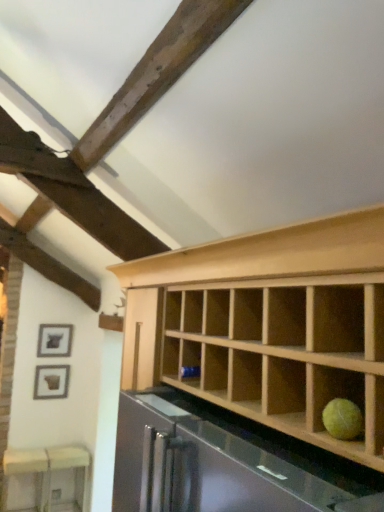
Describe the element at coordinates (51, 382) in the screenshot. I see `matte black picture frame at lower left, the 2th picture frame when ordered from top to bottom` at that location.

Image resolution: width=384 pixels, height=512 pixels. Identify the location of matte black picture frame at upper left, the second picture frame from the bottom. (54, 340).

You are a GUI agent. You are given a task and a screenshot of the screen. Output one action in this format:
    pyautogui.click(x=<x>, y=<y>)
    Task: Click on the matte black picture frame at lower left, the 2th picture frame when ordered from top to bottom
    Image resolution: width=384 pixels, height=512 pixels.
    Given the screenshot: What is the action you would take?
    pyautogui.click(x=51, y=382)

Does matte black picture frame at lower left, which ranks as the 1th picture frame in bottom-to-top order, have a greater height compared to white glossy table at lower left?

In fact, matte black picture frame at lower left, which ranks as the 1th picture frame in bottom-to-top order, may be shorter than white glossy table at lower left.

Which object is positioned more to the left, matte black picture frame at lower left, the 2th picture frame when ordered from top to bottom, or white glossy table at lower left?

white glossy table at lower left.

Is matte black picture frame at lower left, the 2th picture frame when ordered from top to bottom, aimed at matte black picture frame at upper left, the second picture frame from the bottom?

No, matte black picture frame at lower left, the 2th picture frame when ordered from top to bottom, is not aimed at matte black picture frame at upper left, the second picture frame from the bottom.

I want to click on picture frame on the left of matte black picture frame at upper left, the second picture frame from the bottom, so click(x=51, y=382).

Which object is further away from the camera taking this photo, matte black picture frame at lower left, which ranks as the 1th picture frame in bottom-to-top order, or matte black picture frame at upper left, acting as the first picture frame starting from the top?

matte black picture frame at upper left, acting as the first picture frame starting from the top, is further away from the camera.

Can you confirm if matte black picture frame at lower left, the 2th picture frame when ordered from top to bottom, is smaller than matte black picture frame at upper left, the second picture frame from the bottom?

No.

Considering the positions of objects white glossy table at lower left and matte black picture frame at upper left, acting as the first picture frame starting from the top, in the image provided, who is more to the left, white glossy table at lower left or matte black picture frame at upper left, acting as the first picture frame starting from the top,?

From the viewer's perspective, white glossy table at lower left appears more on the left side.

Does white glossy table at lower left have a lesser height compared to matte black picture frame at upper left, acting as the first picture frame starting from the top?

No.

Can you confirm if white glossy table at lower left is smaller than matte black picture frame at upper left, the second picture frame from the bottom?

No, white glossy table at lower left is not smaller than matte black picture frame at upper left, the second picture frame from the bottom.

From the image's perspective, is white glossy table at lower left beneath matte black picture frame at upper left, the second picture frame from the bottom?

Yes, from the image's perspective, white glossy table at lower left is below matte black picture frame at upper left, the second picture frame from the bottom.

Which object is more forward, white glossy table at lower left or matte black picture frame at lower left, which ranks as the 1th picture frame in bottom-to-top order?

Positioned in front is white glossy table at lower left.

Could you tell me if white glossy table at lower left is turned towards matte black picture frame at lower left, which ranks as the 1th picture frame in bottom-to-top order?

No, white glossy table at lower left is not oriented towards matte black picture frame at lower left, which ranks as the 1th picture frame in bottom-to-top order.

Which object is further away from the camera, matte black picture frame at upper left, the second picture frame from the bottom, or matte black picture frame at lower left, the 2th picture frame when ordered from top to bottom?

Positioned behind is matte black picture frame at upper left, the second picture frame from the bottom.

From a real-world perspective, which is physically above, matte black picture frame at upper left, acting as the first picture frame starting from the top, or matte black picture frame at lower left, which ranks as the 1th picture frame in bottom-to-top order?

From a 3D spatial view, matte black picture frame at upper left, acting as the first picture frame starting from the top, is above.

Can you confirm if matte black picture frame at upper left, acting as the first picture frame starting from the top, is wider than matte black picture frame at lower left, the 2th picture frame when ordered from top to bottom?

Incorrect, the width of matte black picture frame at upper left, acting as the first picture frame starting from the top, does not surpass that of matte black picture frame at lower left, the 2th picture frame when ordered from top to bottom.

Considering the positions of objects matte black picture frame at upper left, acting as the first picture frame starting from the top, and white glossy table at lower left in the image provided, who is in front, matte black picture frame at upper left, acting as the first picture frame starting from the top, or white glossy table at lower left?

white glossy table at lower left is closer to the camera.

Does matte black picture frame at upper left, the second picture frame from the bottom, have a lesser height compared to white glossy table at lower left?

Yes, matte black picture frame at upper left, the second picture frame from the bottom, is shorter than white glossy table at lower left.

Identify the location of picture frame that is the 2nd object located behind the white glossy table at lower left. (54, 340).

Does matte black picture frame at upper left, acting as the first picture frame starting from the top, have a larger size compared to white glossy table at lower left?

Incorrect, matte black picture frame at upper left, acting as the first picture frame starting from the top, is not larger than white glossy table at lower left.

You are a GUI agent. You are given a task and a screenshot of the screen. Output one action in this format:
    pyautogui.click(x=<x>, y=<y>)
    Task: Click on the table in front of the matte black picture frame at lower left, the 2th picture frame when ordered from top to bottom
    This screenshot has height=512, width=384.
    Given the screenshot: What is the action you would take?
    pyautogui.click(x=51, y=471)

Where is `picture frame located above the matte black picture frame at lower left, which ranks as the 1th picture frame in bottom-to-top order (from a real-world perspective)`? picture frame located above the matte black picture frame at lower left, which ranks as the 1th picture frame in bottom-to-top order (from a real-world perspective) is located at coordinates (54, 340).

Considering their positions, is matte black picture frame at upper left, the second picture frame from the bottom, positioned closer to white glossy table at lower left than matte black picture frame at lower left, which ranks as the 1th picture frame in bottom-to-top order?

Among the two, matte black picture frame at lower left, which ranks as the 1th picture frame in bottom-to-top order, is located nearer to white glossy table at lower left.

Looking at the image, which one is located closer to matte black picture frame at lower left, the 2th picture frame when ordered from top to bottom, white glossy table at lower left or matte black picture frame at upper left, acting as the first picture frame starting from the top?

matte black picture frame at upper left, acting as the first picture frame starting from the top, is positioned closer to the anchor matte black picture frame at lower left, the 2th picture frame when ordered from top to bottom.

From the image, which object appears to be farther from matte black picture frame at lower left, the 2th picture frame when ordered from top to bottom, matte black picture frame at upper left, the second picture frame from the bottom, or white glossy table at lower left?

white glossy table at lower left is positioned further to the anchor matte black picture frame at lower left, the 2th picture frame when ordered from top to bottom.

Based on their spatial positions, is matte black picture frame at lower left, which ranks as the 1th picture frame in bottom-to-top order, or matte black picture frame at upper left, acting as the first picture frame starting from the top, further from white glossy table at lower left?

matte black picture frame at upper left, acting as the first picture frame starting from the top, is positioned further to the anchor white glossy table at lower left.

Which object lies nearer to the anchor point matte black picture frame at upper left, the second picture frame from the bottom, matte black picture frame at lower left, the 2th picture frame when ordered from top to bottom, or white glossy table at lower left?

Result: matte black picture frame at lower left, the 2th picture frame when ordered from top to bottom.

When comparing their distances from matte black picture frame at upper left, acting as the first picture frame starting from the top, does white glossy table at lower left or matte black picture frame at lower left, the 2th picture frame when ordered from top to bottom, seem closer?

matte black picture frame at lower left, the 2th picture frame when ordered from top to bottom, is positioned closer to the anchor matte black picture frame at upper left, acting as the first picture frame starting from the top.

Where is `picture frame between matte black picture frame at upper left, acting as the first picture frame starting from the top, and white glossy table at lower left, in the vertical direction`? This screenshot has height=512, width=384. picture frame between matte black picture frame at upper left, acting as the first picture frame starting from the top, and white glossy table at lower left, in the vertical direction is located at coordinates (51, 382).